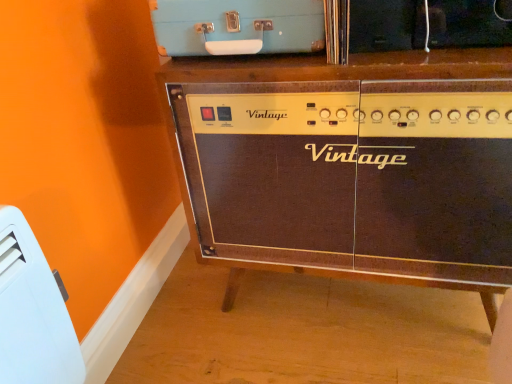
Question: Is white plastic heater at lower left, placed as the 1th appliance when sorted from bottom to top, bigger than brown wood cabinet at center?

Choices:
 (A) no
 (B) yes

Answer: (A)

Question: Can you confirm if white plastic heater at lower left, which is the 1th appliance in left-to-right order, is thinner than brown wood cabinet at center?

Choices:
 (A) yes
 (B) no

Answer: (A)

Question: Considering the relative sizes of white plastic heater at lower left, the 2th appliance positioned from the right, and brown wood cabinet at center in the image provided, is white plastic heater at lower left, the 2th appliance positioned from the right, taller than brown wood cabinet at center?

Choices:
 (A) no
 (B) yes

Answer: (A)

Question: Is white plastic heater at lower left, the 2th appliance positioned from the right, outside of brown wood cabinet at center?

Choices:
 (A) no
 (B) yes

Answer: (B)

Question: From the image's perspective, is white plastic heater at lower left, placed as the 1th appliance when sorted from bottom to top, above brown wood cabinet at center?

Choices:
 (A) yes
 (B) no

Answer: (B)

Question: From a real-world perspective, relative to brown wood cabinet at center, is white plastic heater at lower left, the 2th appliance positioned from the right, vertically above or below?

Choices:
 (A) above
 (B) below

Answer: (A)

Question: In the image, is white plastic heater at lower left, which is the 1th appliance in left-to-right order, on the left side or the right side of brown wood cabinet at center?

Choices:
 (A) right
 (B) left

Answer: (B)

Question: Is white plastic heater at lower left, which is counted as the 2th appliance, starting from the top, in front of or behind brown wood cabinet at center in the image?

Choices:
 (A) front
 (B) behind

Answer: (A)

Question: From the image's perspective, is white plastic heater at lower left, which is the 1th appliance in left-to-right order, positioned above or below brown wood cabinet at center?

Choices:
 (A) below
 (B) above

Answer: (A)

Question: Is point (61, 350) positioned closer to the camera than point (298, 11)?

Choices:
 (A) farther
 (B) closer

Answer: (B)

Question: In terms of height, does white plastic heater at lower left, which is counted as the 2th appliance, starting from the top, look taller or shorter compared to light blue plastic suitcase at upper center, arranged as the first appliance when viewed from the right?

Choices:
 (A) tall
 (B) short

Answer: (A)

Question: Is white plastic heater at lower left, the 2th appliance positioned from the right, in front of or behind light blue plastic suitcase at upper center, which is counted as the 1th appliance, starting from the top, in the image?

Choices:
 (A) behind
 (B) front

Answer: (B)

Question: Which is correct: white plastic heater at lower left, which is counted as the 2th appliance, starting from the top, is inside light blue plastic suitcase at upper center, which is counted as the 1th appliance, starting from the top, or outside of it?

Choices:
 (A) outside
 (B) inside

Answer: (A)

Question: Considering the positions of light blue plastic suitcase at upper center, which is counted as the 1th appliance, starting from the top, and white plastic heater at lower left, which is the 1th appliance in left-to-right order, in the image, is light blue plastic suitcase at upper center, which is counted as the 1th appliance, starting from the top, taller or shorter than white plastic heater at lower left, which is the 1th appliance in left-to-right order,?

Choices:
 (A) short
 (B) tall

Answer: (A)

Question: From a real-world perspective, is light blue plastic suitcase at upper center, positioned as the 2th appliance in left-to-right order, above or below white plastic heater at lower left, which is the 1th appliance in left-to-right order?

Choices:
 (A) above
 (B) below

Answer: (A)